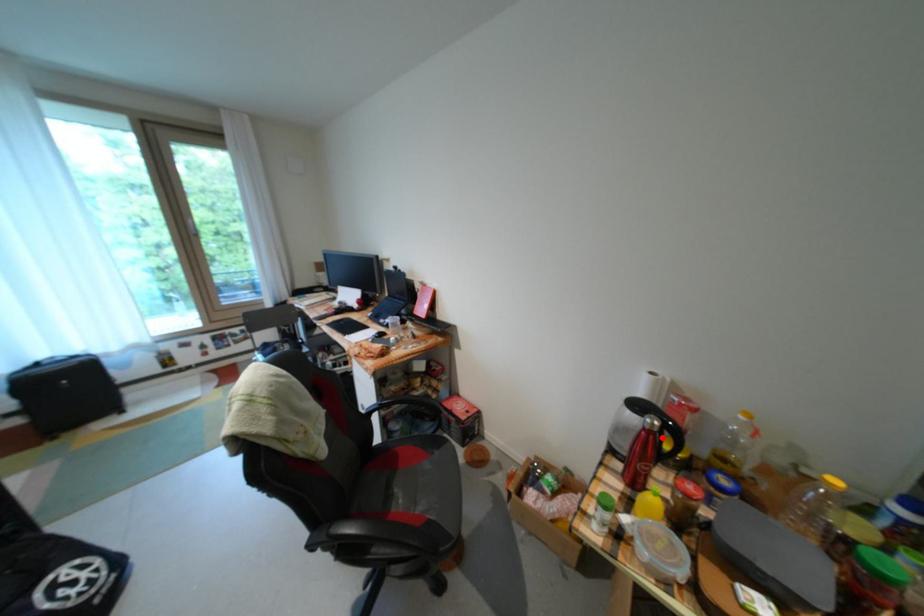
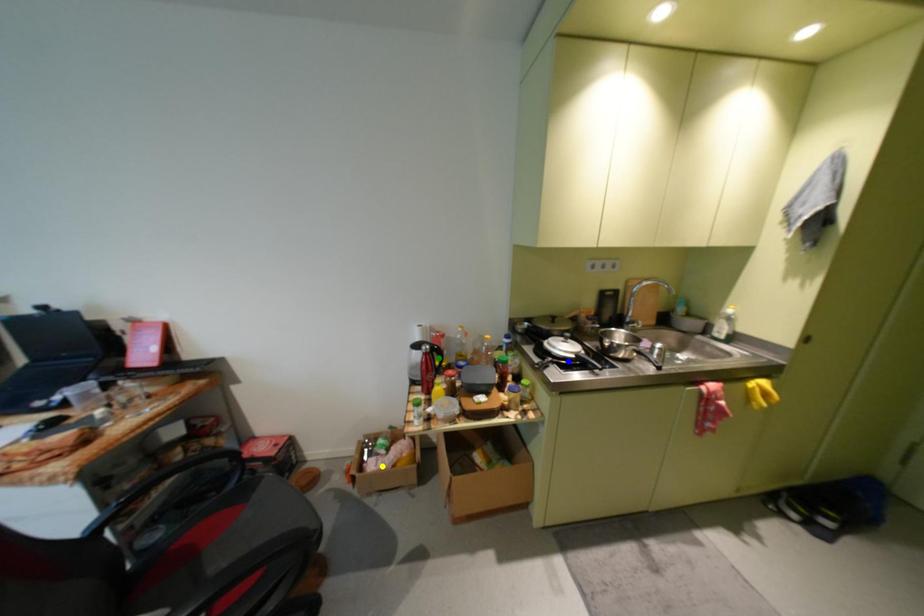
Question: I am providing you with two images of the same scene from different viewpoints. A red point is marked on the first image. You are given multiple points on the second image. Which point in image 2 is actually the same real-world point as the red point in image 1?

Choices:
 (A) yellow point
 (B) green point
 (C) blue point

Answer: (B)